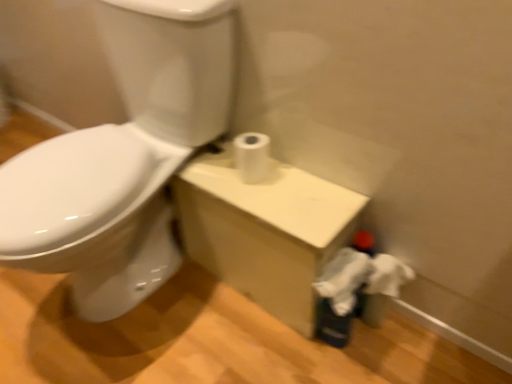
What do you see at coordinates (252, 157) in the screenshot? Image resolution: width=512 pixels, height=384 pixels. I see `white matte toilet paper at center` at bounding box center [252, 157].

You are a GUI agent. You are given a task and a screenshot of the screen. Output one action in this format:
    pyautogui.click(x=<x>, y=<y>)
    Task: Click on the white matte toilet paper at center
    This screenshot has width=512, height=384.
    Given the screenshot: What is the action you would take?
    pyautogui.click(x=252, y=157)

Locate an element on the screen. The width and height of the screenshot is (512, 384). white matte toilet paper at center is located at coordinates (252, 157).